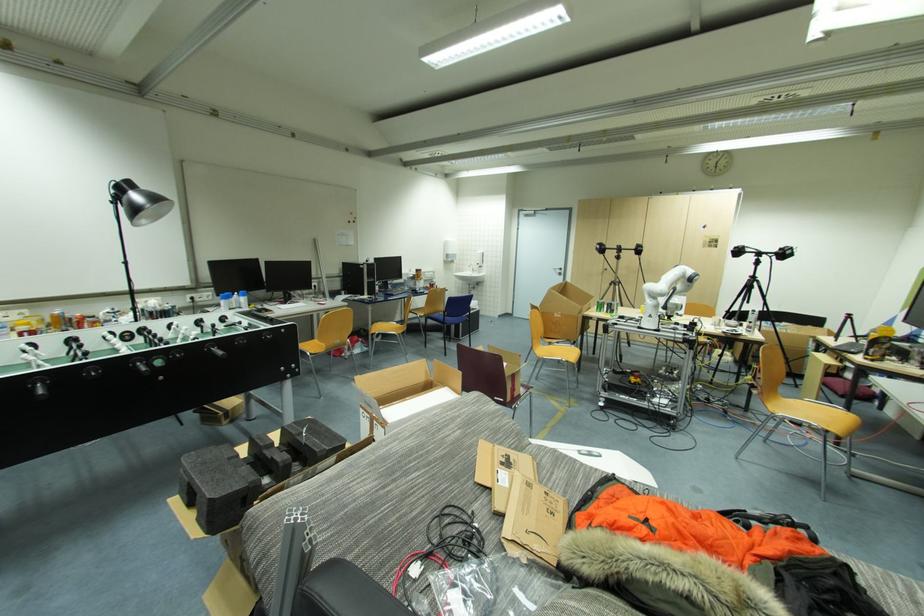
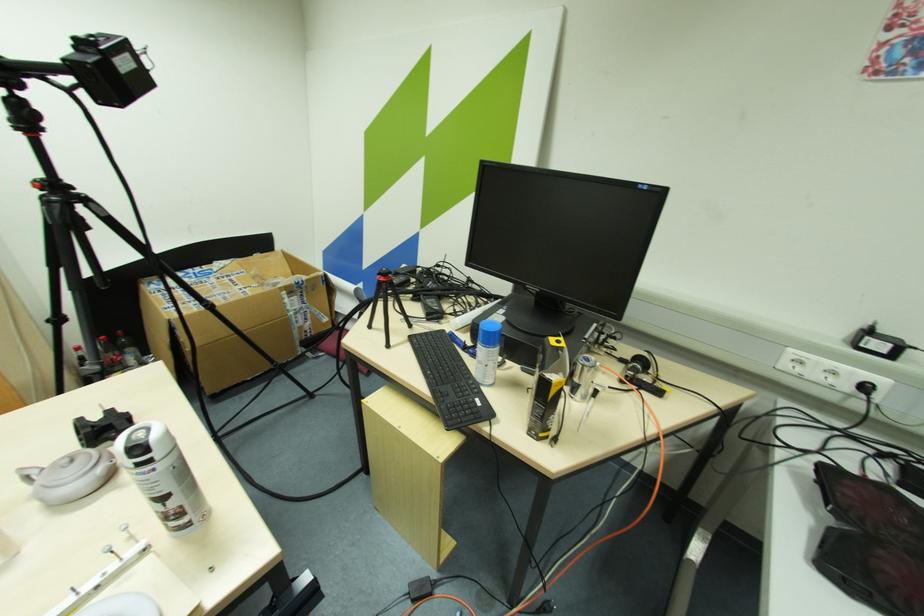
Where in the second image is the point corresponding to point 754,323 from the first image?

(164, 500)